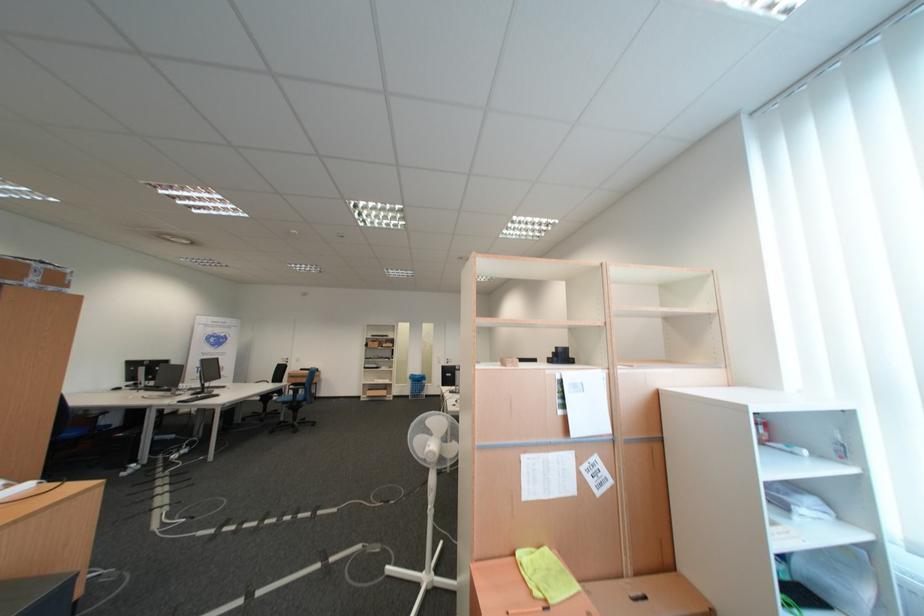
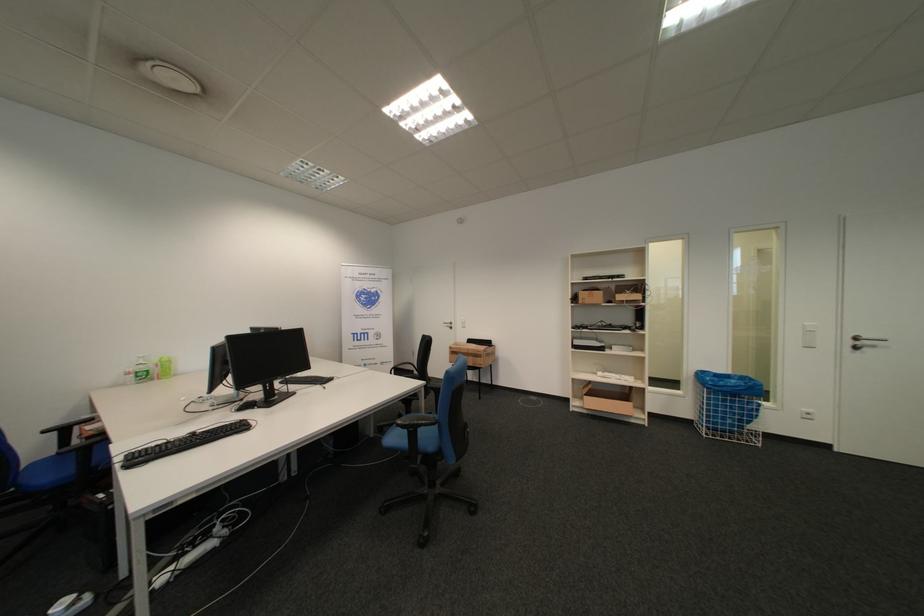
Where in the second image is the point corresponding to (382,345) from the first image?

(594, 296)